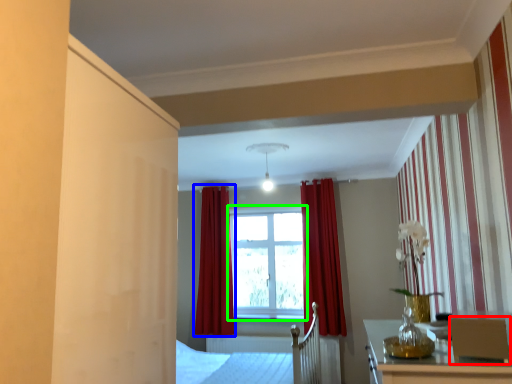
Question: Which object is positioned farthest from armchair (highlighted by a red box)? Select from curtain (highlighted by a blue box) and window (highlighted by a green box).

Choices:
 (A) curtain
 (B) window

Answer: (A)